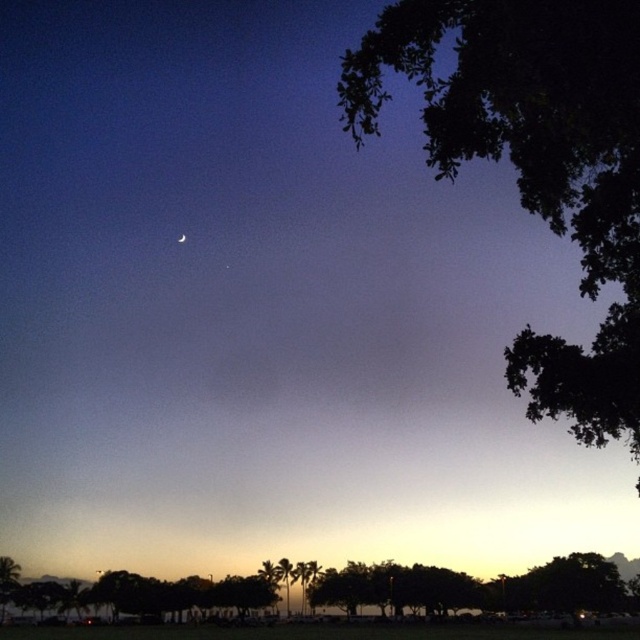
You are an astronomer observing the twilight scene. You notice the green leafy tree at lower left and the silver metallic crescent moon at upper center. Which object appears taller in the image?

The green leafy tree at lower left is taller than the silver metallic crescent moon at upper center in the image.

From the picture: You are standing in the twilight scene and want to take a photo of both the green leafy tree at lower center and the green leafy tree at lower left. Which tree should you focus on first to ensure both are in the frame?

You should focus on the green leafy tree at lower center first because it is larger in size than the green leafy tree at lower left, ensuring it fits within the frame while the smaller tree remains visible.

In the twilight scene, you notice two trees in the image. The first is the dark green leafy tree at upper right, and the second is the green leafy tree at lower center. Which of these two trees appears larger in the image?

The dark green leafy tree at upper right appears larger than the green leafy tree at lower center.